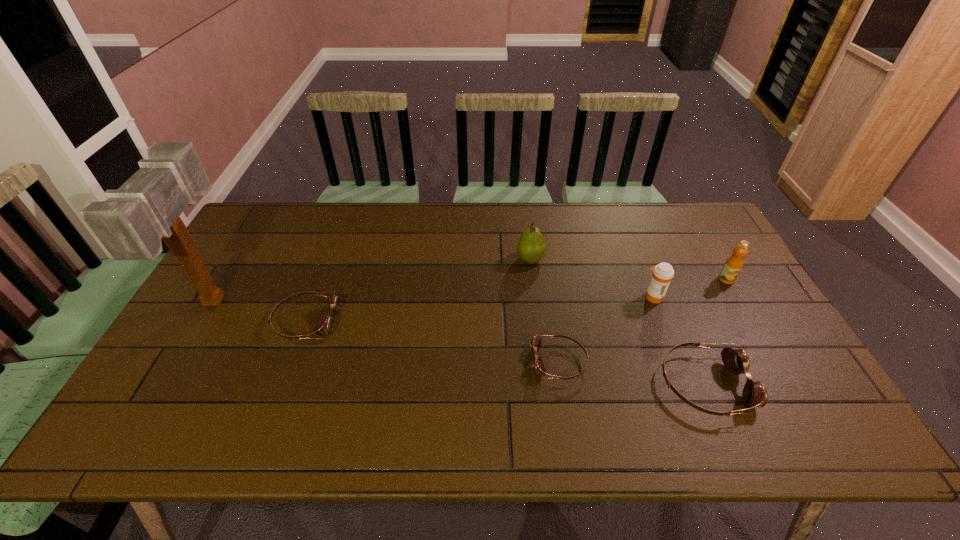
Find the location of a particular element. object located in the left edge section of the desktop is located at coordinates click(130, 224).

Locate an element on the screen. This screenshot has height=540, width=960. goggles that is positioned at the right edge is located at coordinates click(736, 361).

Where is `orange juice that is at the right edge`? orange juice that is at the right edge is located at coordinates (733, 265).

At what (x,y) coordinates should I click in order to perform the action: click on object at the near right corner. Please return your answer as a coordinate pair (x, y). Image resolution: width=960 pixels, height=540 pixels. Looking at the image, I should click on (736, 361).

In the image, there is a desktop. In order to click on free space at the far edge in this screenshot , I will do `click(389, 214)`.

At what (x,y) coordinates should I click in order to perform the action: click on free location at the near edge. Please return your answer as a coordinate pair (x, y). This screenshot has height=540, width=960. Looking at the image, I should click on (694, 386).

This screenshot has width=960, height=540. I want to click on free spot at the right edge of the desktop, so click(721, 301).

At what (x,y) coordinates should I click in order to perform the action: click on vacant space at the far left corner of the desktop. Please return your answer as a coordinate pair (x, y). The image size is (960, 540). Looking at the image, I should click on (258, 237).

Where is `vacant region at the far right corner of the desktop`? vacant region at the far right corner of the desktop is located at coordinates (708, 235).

This screenshot has height=540, width=960. What are the coordinates of `free area in between the leftmost object and the second goggles from left to right` in the screenshot? It's located at (388, 331).